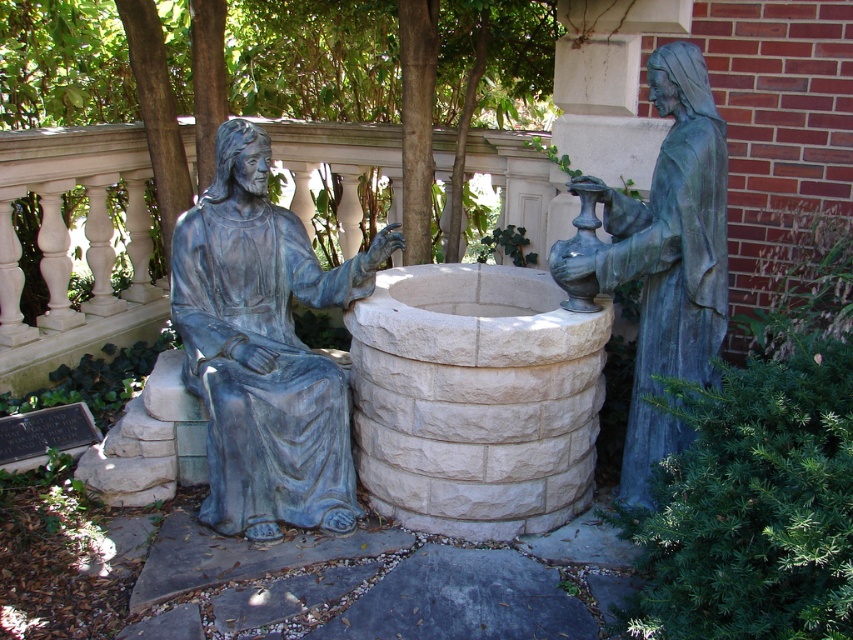
Question: From the image, what is the correct spatial relationship of blue patina statue at left in relation to bronze statue at right?

Choices:
 (A) below
 (B) above

Answer: (A)

Question: In this image, where is blue patina statue at left located relative to bronze statue at right?

Choices:
 (A) above
 (B) below

Answer: (B)

Question: Which of the following is the farthest from the observer?

Choices:
 (A) (229, 344)
 (B) (695, 312)

Answer: (A)

Question: Which point is farther to the camera?

Choices:
 (A) (317, 292)
 (B) (637, 387)

Answer: (A)

Question: Is blue patina statue at left below bronze statue at right?

Choices:
 (A) no
 (B) yes

Answer: (B)